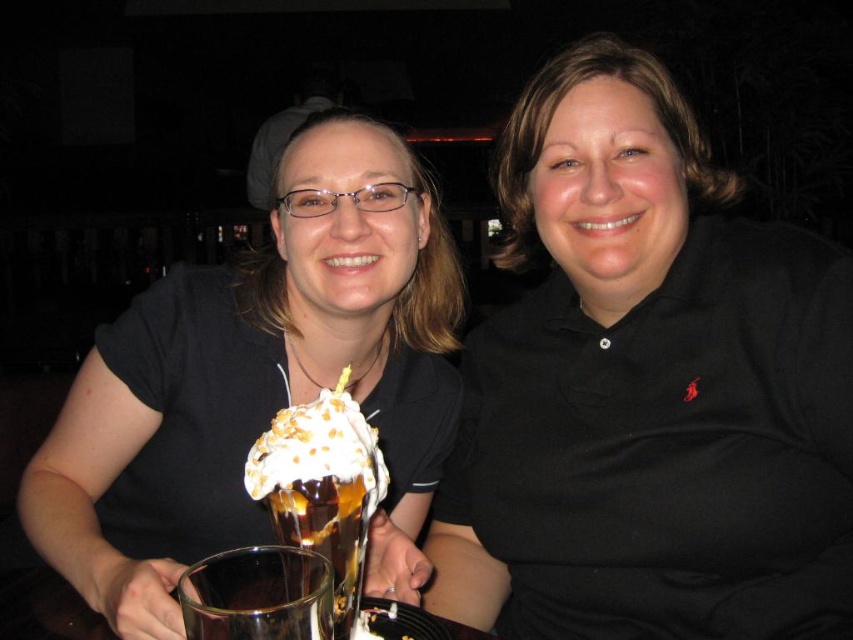
You are a waiter who needs to deliver a dessert to the center of the table. The table has a whipped cream topped sundae at center and a translucent glass cup at center. Which item should you move to place the new dessert?

The whipped cream topped sundae at center is above the translucent glass cup at center, so you should move the translucent glass cup at center to make space for the new dessert.

You are a photographer standing behind the two people in the image. You want to take a photo of the whipped cream topped sundae at center without any obstruction. Is the matte black shirt at center blocking the view of the sundae?

The matte black shirt at center is much taller than the whipped cream topped sundae at center, so it would block the view of the sundae.